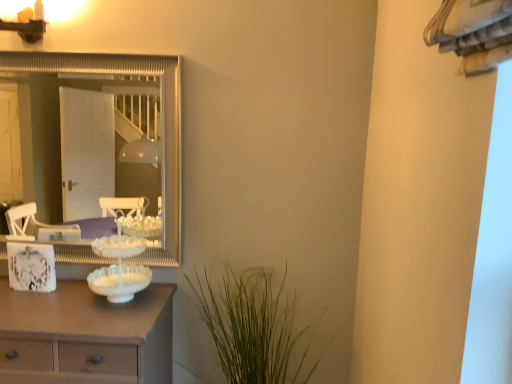
Locate an element on the screen. This screenshot has height=384, width=512. vacant space underneath white frosted glass candle holder at center (from a real-world perspective) is located at coordinates (120, 300).